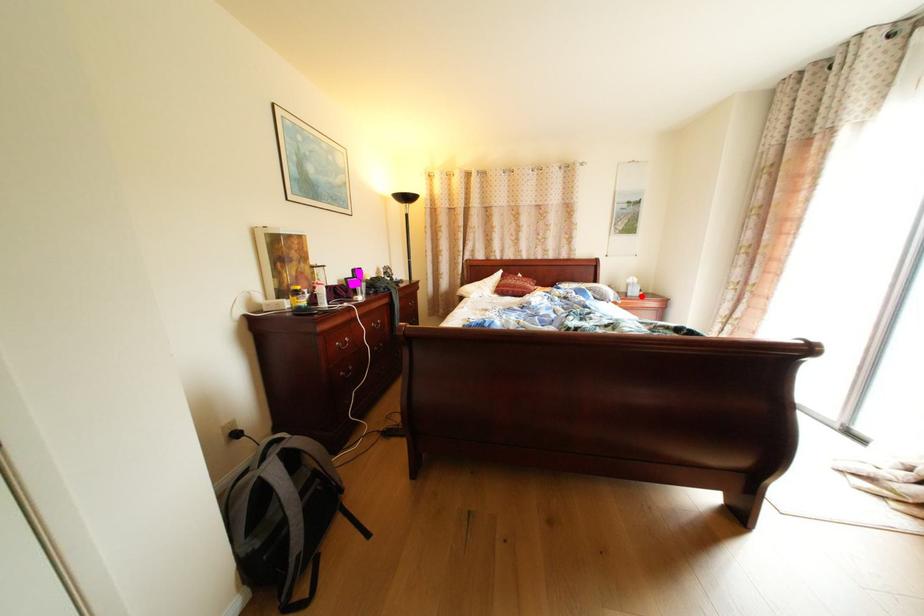
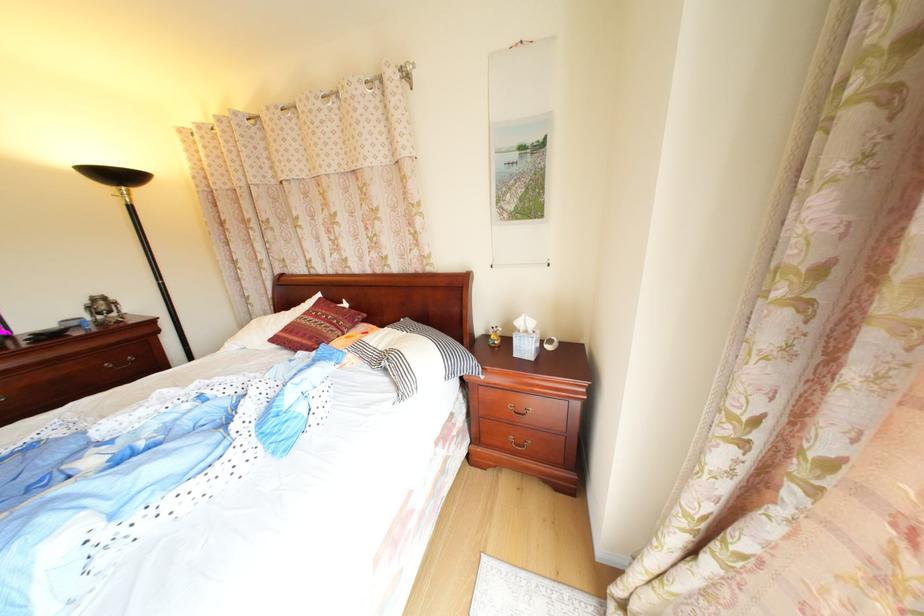
Where in the second image is the point corresponding to the highlighted location from the first image?

(529, 357)